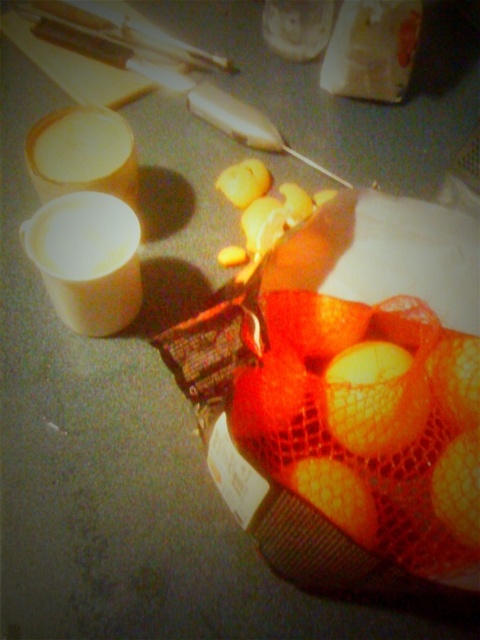
You are organizing the kitchen and need to place the white mesh bag at upper center and the orange matte mesh bag at center. According to the image, which one is positioned higher?

The white mesh bag at upper center is positioned higher than the orange matte mesh bag at center.

You are organizing your kitchen and need to choose between the white mesh bag at upper center and the orange matte mesh bag at center. Which one has a larger capacity for storing vegetables?

The white mesh bag at upper center is bigger than the orange matte mesh bag at center, so it has a larger capacity for storing vegetables.

You are organizing items in the kitchen and need to place the white mesh bag at upper center. Where exactly should you position it based on the coordinates provided?

The white mesh bag at upper center should be positioned at coordinates point (372,49) according to the description.